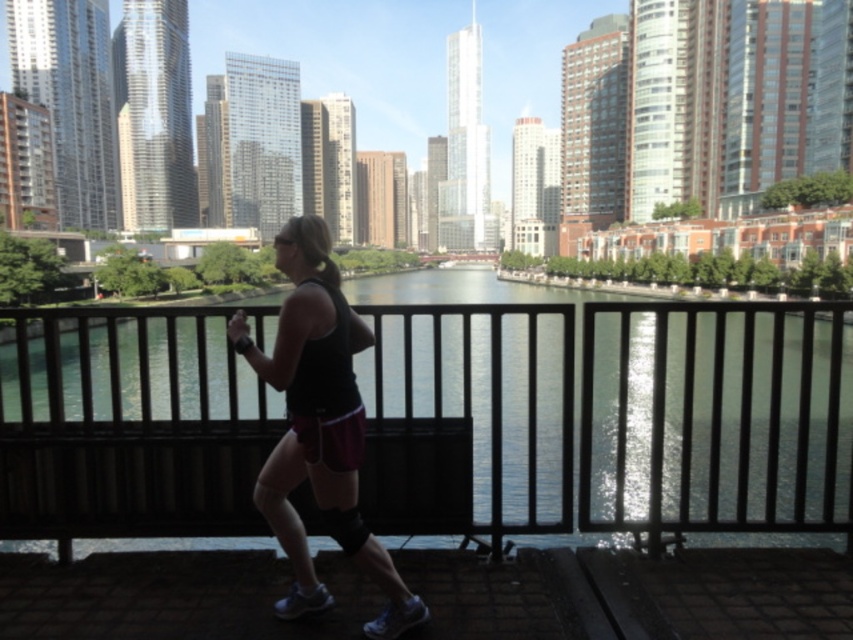
Question: Which of the following is the farthest from the observer?

Choices:
 (A) green glass water at center
 (B) black matte tank top at center

Answer: (A)

Question: Is green glass water at center behind black matte tank top at center?

Choices:
 (A) no
 (B) yes

Answer: (B)

Question: Does green glass water at center appear on the right side of black matte tank top at center?

Choices:
 (A) yes
 (B) no

Answer: (A)

Question: Which point is closer to the camera?

Choices:
 (A) pos(331,419)
 (B) pos(486,288)

Answer: (A)

Question: Is green glass water at center positioned before black matte tank top at center?

Choices:
 (A) no
 (B) yes

Answer: (A)

Question: Among these points, which one is farthest from the camera?

Choices:
 (A) (303, 465)
 (B) (466, 493)

Answer: (B)